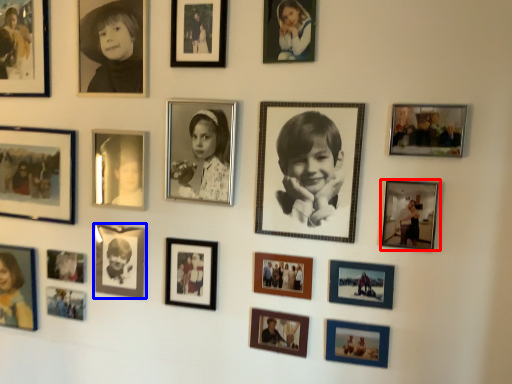
Question: Which point is closer to the camera, picture frame (highlighted by a red box) or picture frame (highlighted by a blue box)?

Choices:
 (A) picture frame
 (B) picture frame

Answer: (A)